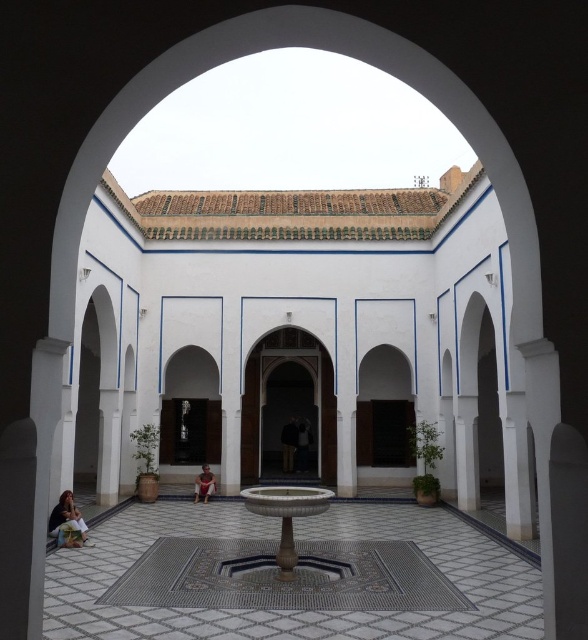
You are standing at the entrance of the Moroccan courtyard, looking through the white archway. You want to walk directly to the white mosaic fountain at center. Which direction should you walk to reach it?

Since the white mosaic fountain at center is located at the center of the courtyard, you should walk straight ahead through the white archway to reach it.

You are a photographer standing in the Moroccan courtyard. You notice the matte pink dress at lower left and the matte white person at center. Which object is closer to the left side of the archway?

The matte pink dress at lower left is closer to the left side of the archway because it is positioned on the left side of the matte white person at center.

You are standing in the Moroccan courtyard and want to hang the brown leather jacket at center on a hook. The hook is located at the same height as the top of the white mosaic fountain at center. Can the jacket reach the hook without needing a ladder?

The white mosaic fountain at center is much taller than the brown leather jacket at center. Since the hook is at the top of the fountain, the jacket cannot reach it without a ladder.